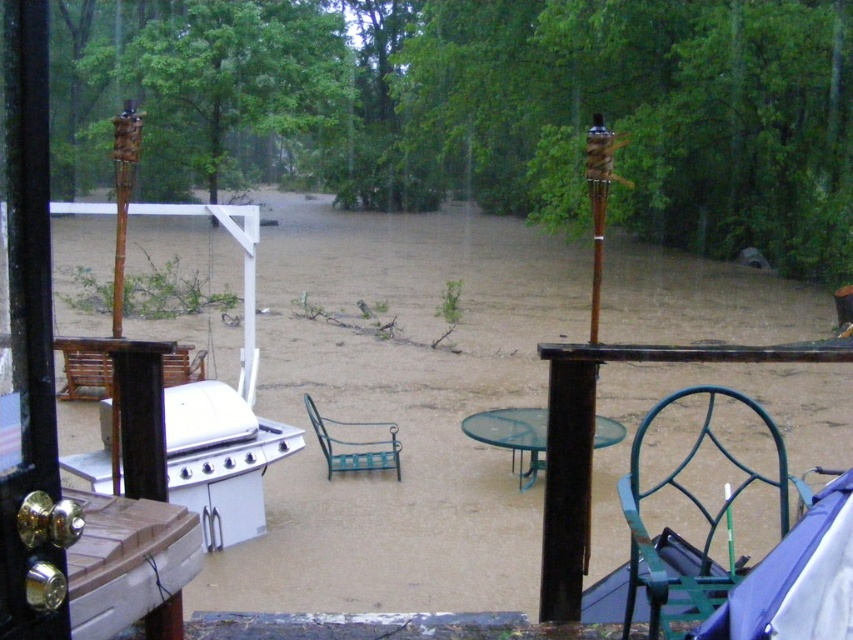
Does blue fabric umbrella at lower right appear on the right side of green wrought iron chair at center?

Correct, you'll find blue fabric umbrella at lower right to the right of green wrought iron chair at center.

Does blue fabric umbrella at lower right appear on the left side of green wrought iron chair at center?

No, blue fabric umbrella at lower right is not to the left of green wrought iron chair at center.

The width and height of the screenshot is (853, 640). I want to click on blue fabric umbrella at lower right, so click(x=798, y=579).

Does white glossy grill at lower left appear over green wire chair at lower right?

No.

Who is higher up, white glossy grill at lower left or green wire chair at lower right?

green wire chair at lower right

The height and width of the screenshot is (640, 853). I want to click on white glossy grill at lower left, so click(x=221, y=458).

This screenshot has width=853, height=640. I want to click on white glossy grill at lower left, so click(221, 458).

Can you confirm if white glossy grill at lower left is shorter than green wrought iron chair at center?

No.

Does point (251, 419) come behind point (354, 452)?

No.

You are a GUI agent. You are given a task and a screenshot of the screen. Output one action in this format:
    pyautogui.click(x=<x>, y=<y>)
    Task: Click on the white glossy grill at lower left
    Image resolution: width=853 pixels, height=640 pixels.
    Given the screenshot: What is the action you would take?
    pyautogui.click(x=221, y=458)